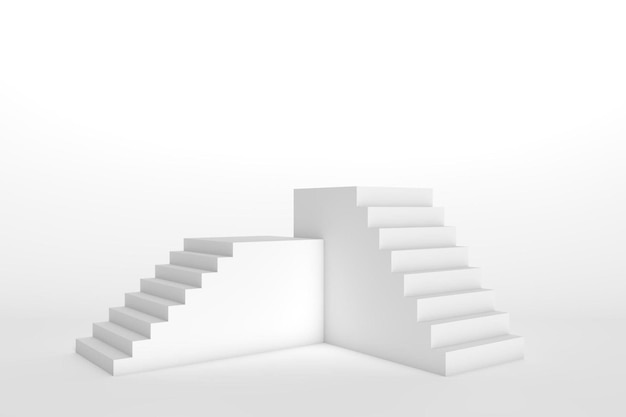
Where is `stair treads on left stairway`? This screenshot has width=626, height=417. stair treads on left stairway is located at coordinates (116, 361), (136, 340), (153, 322), (173, 304), (193, 283), (208, 270), (227, 254).